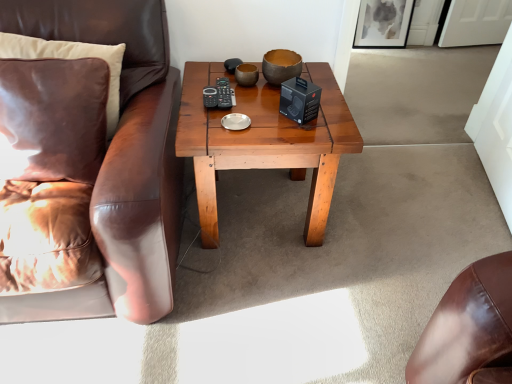
Identify the location of empty space that is ontop of wooden coffee table at center (from a real-world perspective). (256, 107).